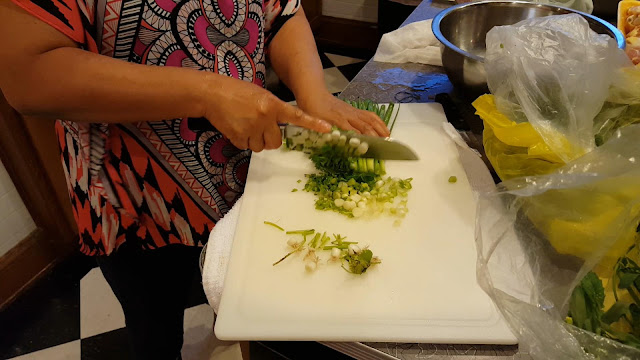
Image resolution: width=640 pixels, height=360 pixels. Find the location of `silver bowl`. silver bowl is located at coordinates (454, 40).